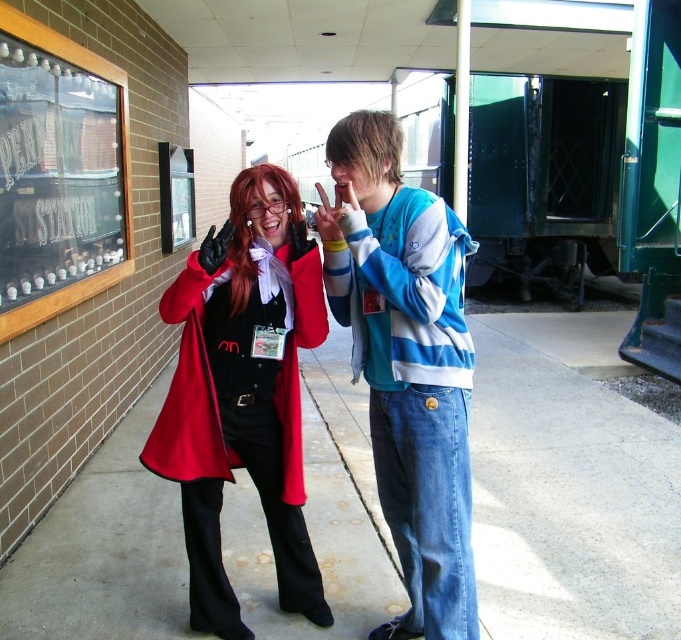
You are standing at the edge of the smooth concrete pavement at center and want to pick up the matte red coat at center. Can you reach it without stepping onto the pavement?

The matte red coat at center is behind the smooth concrete pavement at center, so you can reach it without stepping onto the pavement by bending down from your current position.

You are a delivery person who needs to place a package on the smooth concrete pavement at center. The wooden frame signboard at upper left has a weight limit of 10 kilograms. Can you safely place the package there?

The smooth concrete pavement at center is to the right of wooden frame signboard at upper left. Since the signboard has a weight limit of 10 kilograms, but the question is about placing the package on the pavement, not the signboard. Therefore, the weight limit of the signboard does not affect the placement of the package on the pavement. You can safely place the package on the smooth concrete pavement at center.